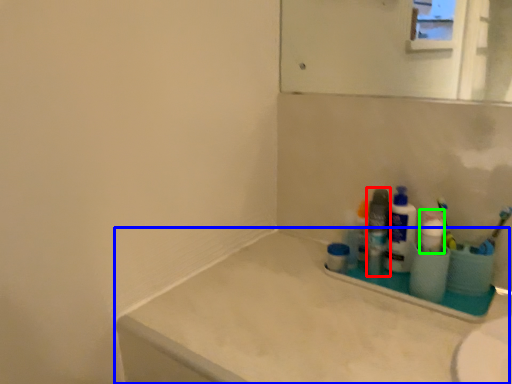
Question: Which object is positioned farthest from toiletry (highlighted by a red box)? Select from counter top (highlighted by a blue box) and cleaning product (highlighted by a green box).

Choices:
 (A) counter top
 (B) cleaning product

Answer: (A)